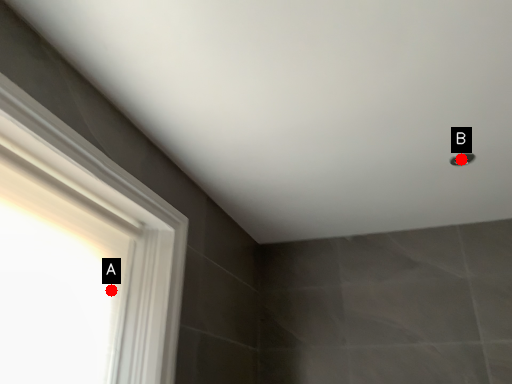
Question: Two points are circled on the image, labeled by A and B beside each circle. Which point is farther from the camera taking this photo?

Choices:
 (A) A is further
 (B) B is further

Answer: (B)